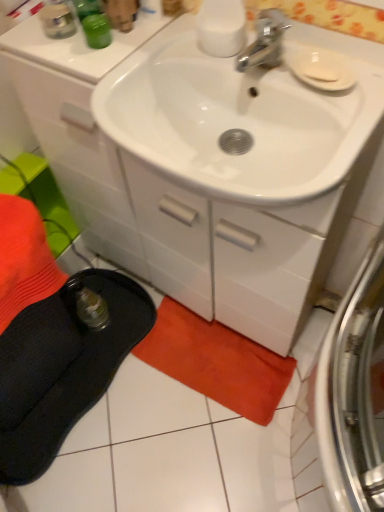
Question: Could orange cotton beach towel at lower center be considered to be inside white matte soap at upper right?

Choices:
 (A) yes
 (B) no

Answer: (B)

Question: Does white matte soap at upper right have a larger size compared to orange cotton beach towel at lower center?

Choices:
 (A) no
 (B) yes

Answer: (A)

Question: From the image's perspective, is white matte soap at upper right under orange cotton beach towel at lower center?

Choices:
 (A) yes
 (B) no

Answer: (B)

Question: Can you confirm if white matte soap at upper right is positioned to the right of orange cotton beach towel at lower center?

Choices:
 (A) no
 (B) yes

Answer: (B)

Question: Considering the relative positions of white matte soap at upper right and orange cotton beach towel at lower center in the image provided, is white matte soap at upper right behind orange cotton beach towel at lower center?

Choices:
 (A) yes
 (B) no

Answer: (B)

Question: Is point (206, 362) positioned closer to the camera than point (173, 276)?

Choices:
 (A) farther
 (B) closer

Answer: (A)

Question: From the image's perspective, relative to white glossy cabinet at center, is orange cotton beach towel at lower center above or below?

Choices:
 (A) above
 (B) below

Answer: (B)

Question: In terms of height, does orange cotton beach towel at lower center look taller or shorter compared to white glossy cabinet at center?

Choices:
 (A) tall
 (B) short

Answer: (B)

Question: From a real-world perspective, is orange cotton beach towel at lower center above or below white glossy cabinet at center?

Choices:
 (A) below
 (B) above

Answer: (A)

Question: In the image, is black fabric slipper at lower left positioned in front of or behind white matte soap at upper right?

Choices:
 (A) behind
 (B) front

Answer: (A)

Question: Would you say black fabric slipper at lower left is to the left or to the right of white matte soap at upper right in the picture?

Choices:
 (A) left
 (B) right

Answer: (A)

Question: In terms of height, does black fabric slipper at lower left look taller or shorter compared to white matte soap at upper right?

Choices:
 (A) short
 (B) tall

Answer: (B)

Question: Choose the correct answer: Is black fabric slipper at lower left inside white matte soap at upper right or outside it?

Choices:
 (A) outside
 (B) inside

Answer: (A)

Question: Based on their sizes in the image, would you say white matte soap at upper right is bigger or smaller than orange cotton beach towel at lower center?

Choices:
 (A) small
 (B) big

Answer: (A)

Question: From a real-world perspective, relative to orange cotton beach towel at lower center, is white matte soap at upper right vertically above or below?

Choices:
 (A) above
 (B) below

Answer: (A)